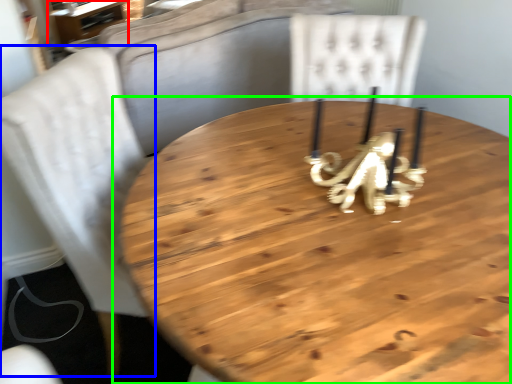
Question: Estimate the real-world distances between objects in this image. Which object is closer to table (highlighted by a red box), chair (highlighted by a blue box) or table (highlighted by a green box)?

Choices:
 (A) chair
 (B) table

Answer: (A)